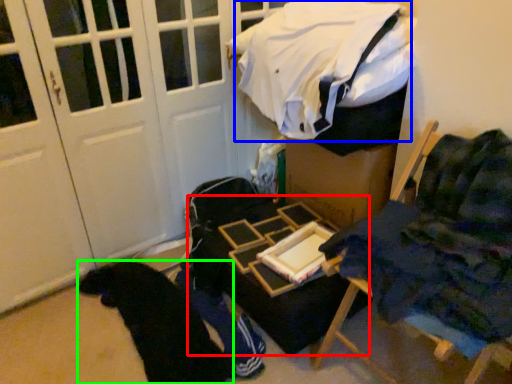
Question: Considering the real-world distances, which object is closest to table (highlighted by a red box)? laundry (highlighted by a blue box) or clothing (highlighted by a green box).

Choices:
 (A) laundry
 (B) clothing

Answer: (B)